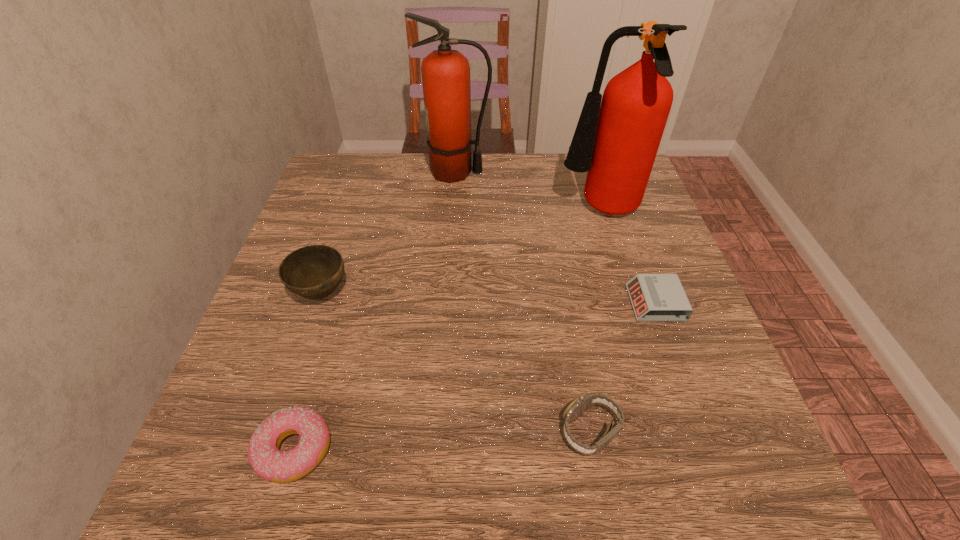
You are a GUI agent. You are given a task and a screenshot of the screen. Output one action in this format:
    pyautogui.click(x=<x>, y=<y>)
    Task: Click on the bowl positioned at the left edge
    
    Given the screenshot: What is the action you would take?
    pyautogui.click(x=314, y=272)

Locate an element on the screen. The height and width of the screenshot is (540, 960). doughnut present at the left edge is located at coordinates point(271,464).

You are a GUI agent. You are given a task and a screenshot of the screen. Output one action in this format:
    pyautogui.click(x=<x>, y=<y>)
    Task: Click on the fire extinguisher positioned at the right edge
    
    Given the screenshot: What is the action you would take?
    pyautogui.click(x=616, y=140)

Find the location of a particular element. alarm clock that is at the right edge is located at coordinates (655, 297).

Identify the location of object situated at the near left corner. Image resolution: width=960 pixels, height=540 pixels. (271, 464).

Where is `object located in the far right corner section of the desktop`? The image size is (960, 540). object located in the far right corner section of the desktop is located at coordinates (616, 140).

Identify the location of vacant space at the far edge. (494, 161).

Locate an element on the screen. vacant region at the near edge of the desktop is located at coordinates (618, 486).

Image resolution: width=960 pixels, height=540 pixels. I want to click on vacant area at the left edge of the desktop, so click(x=337, y=227).

This screenshot has width=960, height=540. Identify the location of vacant space at the right edge. (688, 371).